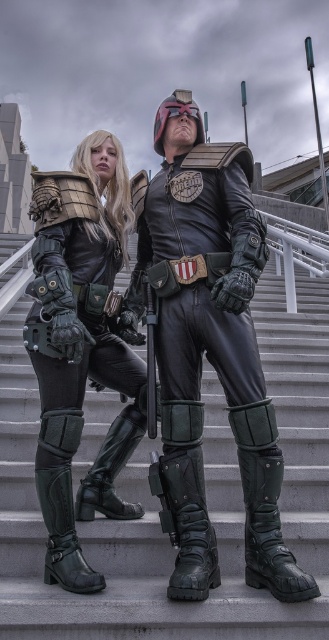
Question: Can you confirm if green leather boot at lower center is positioned below green matte boots at lower center?

Choices:
 (A) yes
 (B) no

Answer: (A)

Question: From the image, what is the correct spatial relationship of leather/metallic armor at center in relation to leather/metallic boot at lower center?

Choices:
 (A) above
 (B) below

Answer: (A)

Question: Estimate the real-world distances between objects in this image. Which object is closer to the black leather boot at lower center?

Choices:
 (A) leather/metallic boot at lower center
 (B) leather/metallic armor at center
 (C) matte black armor at center
 (D) green matte boots at lower center

Answer: (B)

Question: Which object appears closest to the camera in this image?

Choices:
 (A) matte black armor at center
 (B) leather/metallic boot at lower center

Answer: (B)

Question: Is green leather boot at lower center below black leather boot at lower center?

Choices:
 (A) yes
 (B) no

Answer: (B)

Question: Which is nearer to the black leather boot at lower center?

Choices:
 (A) matte black armor at center
 (B) gray concrete stairs at center
 (C) green leather boot at lower center
 (D) green matte boots at lower center

Answer: (C)